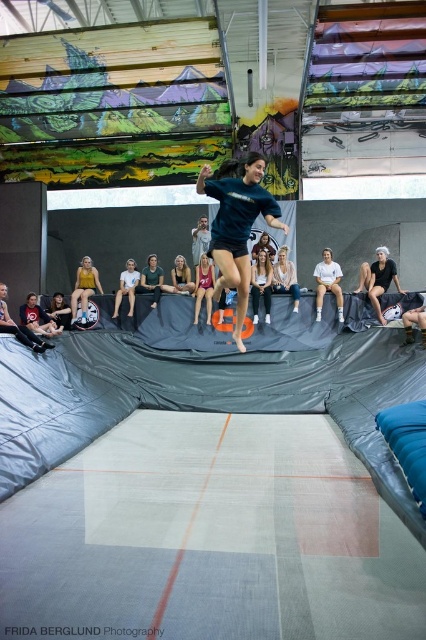
In the scene shown: Can you confirm if light blue fabric at center is positioned above light brown hair at center?

Incorrect, light blue fabric at center is not positioned above light brown hair at center.

Who is more forward, [129,284] or [173,280]?

Point [129,284]

Locate an element on the screen. light blue fabric at center is located at coordinates (126, 288).

Which is below, matte blue shirt at center or matte pink swimsuit at center?

Positioned lower is matte pink swimsuit at center.

Who is more forward, (239,285) or (207,288)?

Point (239,285)

Where is `matte blue shirt at center`? The width and height of the screenshot is (426, 640). matte blue shirt at center is located at coordinates (236, 224).

Is point (201, 292) positioned in front of point (281, 273)?

Yes, point (201, 292) is in front of point (281, 273).

Can you confirm if matte pink swimsuit at center is positioned to the left of light brown hair at upper center?

Yes, matte pink swimsuit at center is to the left of light brown hair at upper center.

Where is `matte pink swimsuit at center`? matte pink swimsuit at center is located at coordinates (204, 285).

This screenshot has width=426, height=640. I want to click on matte pink swimsuit at center, so click(204, 285).